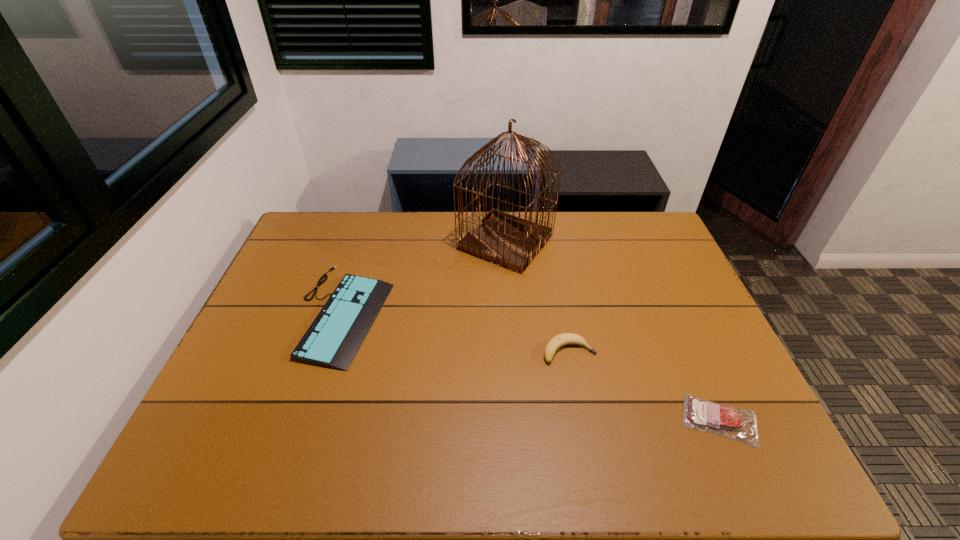
Find the location of `object positioned at the far edge`. object positioned at the far edge is located at coordinates (511, 242).

Where is `object at the near edge`? This screenshot has height=540, width=960. object at the near edge is located at coordinates (739, 424).

Where is `object present at the left edge`? object present at the left edge is located at coordinates (333, 339).

Where is `object that is at the right edge`? The width and height of the screenshot is (960, 540). object that is at the right edge is located at coordinates (739, 424).

Where is `object at the near right corner`? This screenshot has height=540, width=960. object at the near right corner is located at coordinates (739, 424).

Image resolution: width=960 pixels, height=540 pixels. What are the coordinates of `blank space at the far edge of the desktop` in the screenshot? It's located at click(x=539, y=221).

Where is `vacant space at the near edge of the desktop`? The image size is (960, 540). vacant space at the near edge of the desktop is located at coordinates (591, 450).

Locate an element on the screen. vacant area at the left edge of the desktop is located at coordinates (312, 267).

In the image, there is a desktop. Identify the location of vacant space at the right edge. (743, 401).

Locate an element on the screen. The image size is (960, 540). vacant space at the far right corner of the desktop is located at coordinates (640, 237).